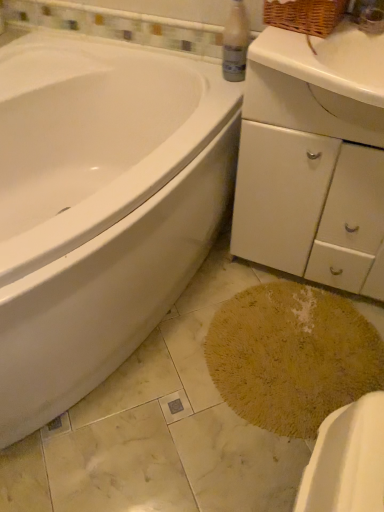
Question: Looking at their shapes, would you say yellow textured rug at lower center is wider or thinner than white glossy bathtub at left?

Choices:
 (A) thin
 (B) wide

Answer: (A)

Question: In the image, is yellow textured rug at lower center positioned in front of or behind white glossy bathtub at left?

Choices:
 (A) behind
 (B) front

Answer: (A)

Question: Estimate the real-world distances between objects in this image. Which object is closer to the woven brown basket at upper right?

Choices:
 (A) yellow textured rug at lower center
 (B) white matte cabinet at center-right
 (C) white glossy bathtub at left
 (D) clear plastic bottle at upper center
 (E) yellow textured bath mat at lower center

Answer: (D)

Question: Which of these objects is positioned closest to the woven brown basket at upper right?

Choices:
 (A) yellow textured rug at lower center
 (B) white glossy bathtub at left
 (C) clear plastic bottle at upper center
 (D) yellow textured bath mat at lower center
 (E) white matte cabinet at center-right

Answer: (C)